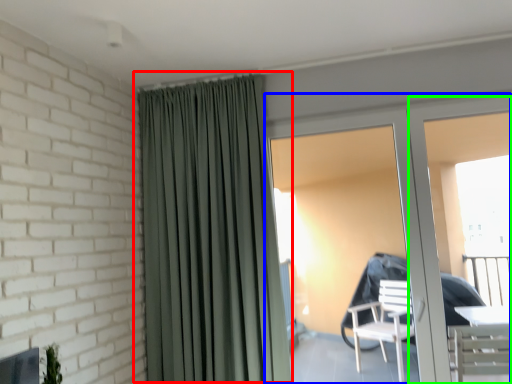
Question: Considering the real-world distances, which object is closest to curtain (highlighted by a red box)? door (highlighted by a blue box) or screen door (highlighted by a green box).

Choices:
 (A) door
 (B) screen door

Answer: (A)